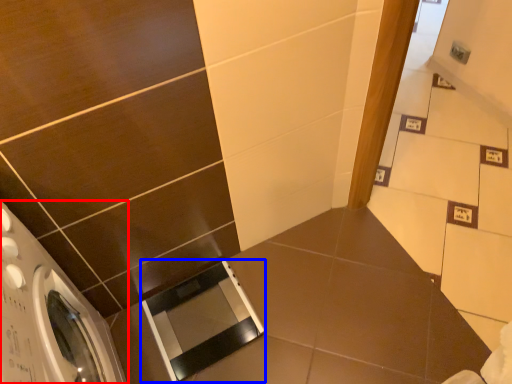
Question: Which object appears farthest to the camera in this image, washing machine (highlighted by a red box) or screen door (highlighted by a blue box)?

Choices:
 (A) washing machine
 (B) screen door

Answer: (B)